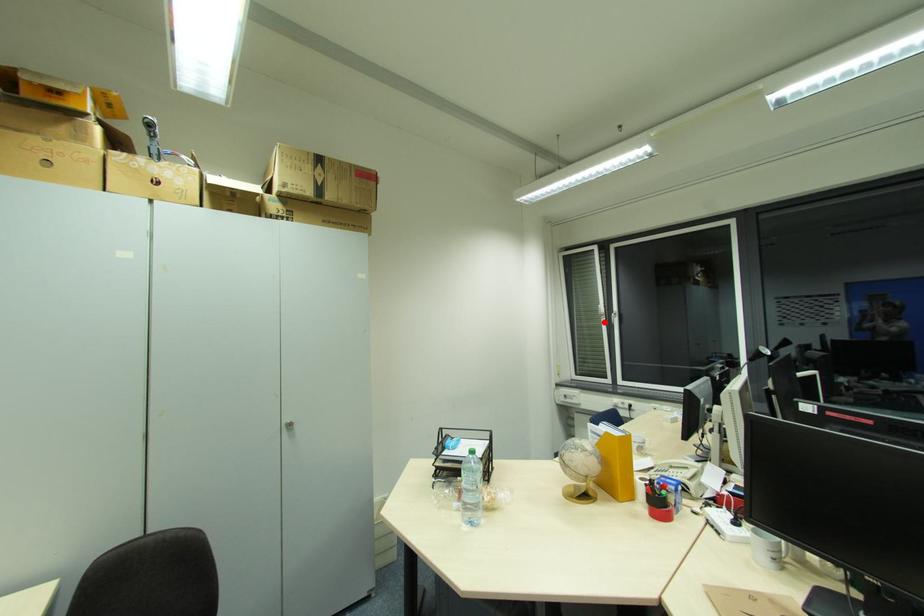
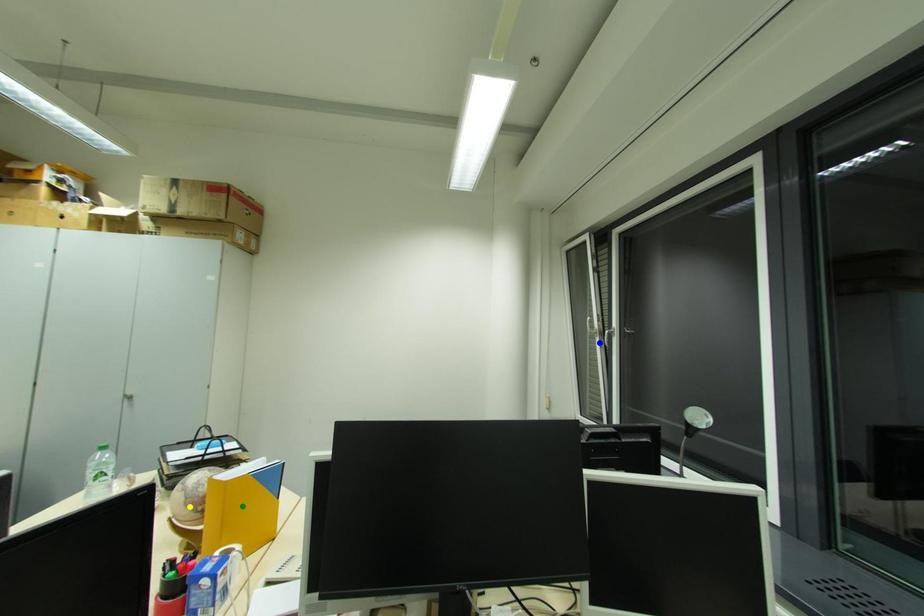
Question: I am providing you with two images of the same scene from different viewpoints. A red point is marked on the first image. You are given multiple points on the second image. Which point in image 2 is actually the same real-world point as the red point in image 1?

Choices:
 (A) green point
 (B) blue point
 (C) yellow point

Answer: (B)